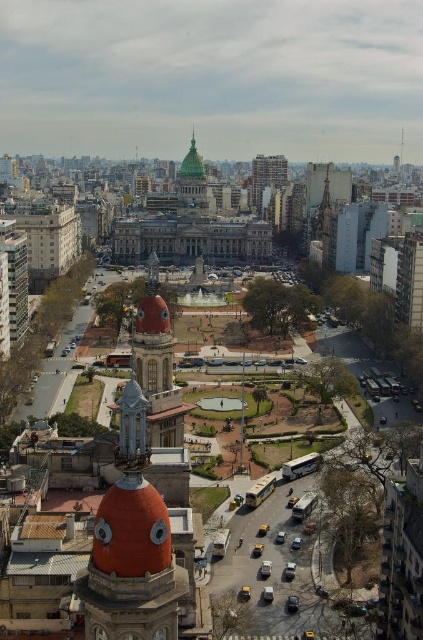
Question: Is green glass dome at center to the left of brick textured building at upper center from the viewer's perspective?

Choices:
 (A) no
 (B) yes

Answer: (B)

Question: Is green glass dome at center below brick textured building at upper center?

Choices:
 (A) yes
 (B) no

Answer: (A)

Question: Which object is farther from the camera taking this photo?

Choices:
 (A) green glass dome at center
 (B) orange terracotta dome at center

Answer: (A)

Question: Can you confirm if orange terracotta dome at center is smaller than green glass dome at center?

Choices:
 (A) yes
 (B) no

Answer: (A)

Question: Which point is closer to the camera taking this photo?

Choices:
 (A) (170, 632)
 (B) (271, 157)

Answer: (A)

Question: Estimate the real-world distances between objects in this image. Which object is farther from the green glass dome at center?

Choices:
 (A) brick textured building at upper center
 (B) orange terracotta dome at center

Answer: (B)